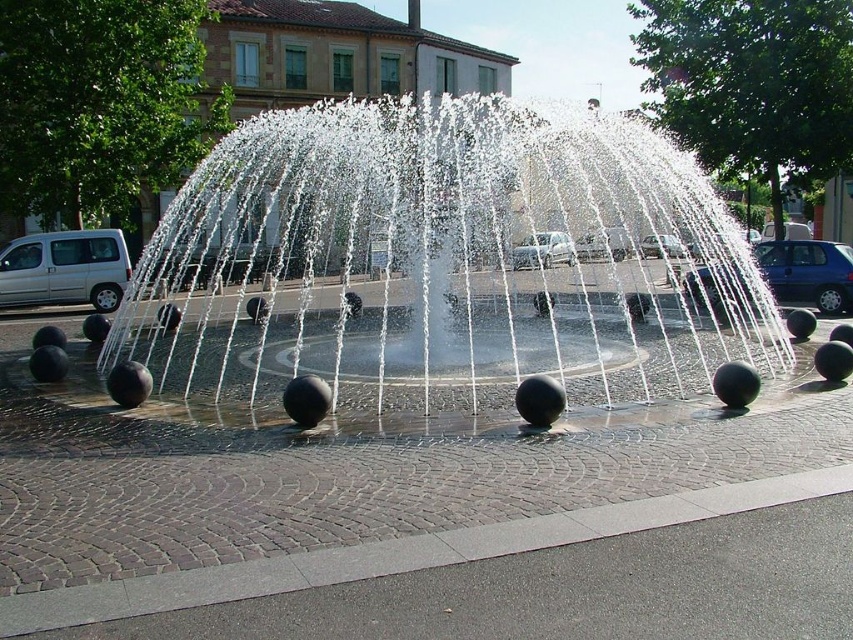
Question: Which point is farther to the camera?

Choices:
 (A) (511, 266)
 (B) (437, 218)

Answer: (A)

Question: Estimate the real-world distances between objects in this image. Which object is farther from the black polished spheres at center?

Choices:
 (A) silver metallic car at center
 (B) blue metallic car at right
 (C) silver metallic van at left

Answer: (B)

Question: Can you confirm if black polished spheres at center is positioned to the right of silver metallic sedan at center?

Choices:
 (A) yes
 (B) no

Answer: (B)

Question: Can you confirm if silver metallic van at left is positioned to the right of silver metallic car at center?

Choices:
 (A) yes
 (B) no

Answer: (B)

Question: Does silver metallic van at left lie behind silver metallic sedan at center?

Choices:
 (A) yes
 (B) no

Answer: (A)

Question: Which point appears closest to the camera in this image?

Choices:
 (A) (672, 241)
 (B) (96, 257)
 (C) (793, 248)

Answer: (A)